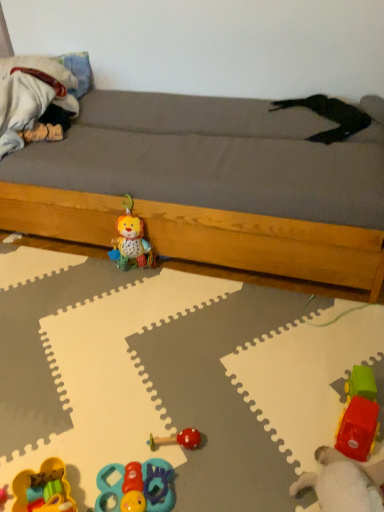
Question: Is rubberized plastic truck at lower right, marked as the 1th toy in a right-to-left arrangement, positioned behind plush fabric lion at center, arranged as the 5th toy when viewed from the right?

Choices:
 (A) yes
 (B) no

Answer: (B)

Question: Is rubberized plastic truck at lower right, marked as the 1th toy in a right-to-left arrangement, positioned with its back to plush fabric lion at center, arranged as the 5th toy when viewed from the right?

Choices:
 (A) yes
 (B) no

Answer: (B)

Question: Is rubberized plastic truck at lower right, the 6th toy positioned from the left, directly adjacent to plush fabric lion at center, arranged as the 5th toy when viewed from the right?

Choices:
 (A) yes
 (B) no

Answer: (B)

Question: Considering the relative sizes of rubberized plastic truck at lower right, the 6th toy positioned from the left, and plush fabric lion at center, arranged as the 5th toy when viewed from the right, in the image provided, is rubberized plastic truck at lower right, the 6th toy positioned from the left, bigger than plush fabric lion at center, arranged as the 5th toy when viewed from the right,?

Choices:
 (A) no
 (B) yes

Answer: (A)

Question: Does rubberized plastic truck at lower right, marked as the 1th toy in a right-to-left arrangement, appear on the right side of plush fabric lion at center, arranged as the 5th toy when viewed from the right?

Choices:
 (A) yes
 (B) no

Answer: (A)

Question: Considering their positions, is wooden bed frame at center located in front of or behind rubberized yellow toy at lower left, marked as the first toy in a left-to-right arrangement?

Choices:
 (A) behind
 (B) front

Answer: (A)

Question: From a real-world perspective, is wooden bed frame at center above or below rubberized yellow toy at lower left, which is counted as the 6th toy, starting from the right?

Choices:
 (A) above
 (B) below

Answer: (A)

Question: From their relative heights in the image, would you say wooden bed frame at center is taller or shorter than rubberized yellow toy at lower left, which is counted as the 6th toy, starting from the right?

Choices:
 (A) short
 (B) tall

Answer: (B)

Question: In terms of size, does wooden bed frame at center appear bigger or smaller than rubberized yellow toy at lower left, marked as the first toy in a left-to-right arrangement?

Choices:
 (A) small
 (B) big

Answer: (B)

Question: Considering the positions of fluffy white blanket at left and plush fabric lion at center, the 2th toy when ordered from left to right, in the image, is fluffy white blanket at left taller or shorter than plush fabric lion at center, the 2th toy when ordered from left to right,?

Choices:
 (A) short
 (B) tall

Answer: (A)

Question: Looking at the image, does fluffy white blanket at left seem bigger or smaller compared to plush fabric lion at center, the 2th toy when ordered from left to right?

Choices:
 (A) big
 (B) small

Answer: (A)

Question: Does point (18, 71) appear closer or farther from the camera than point (147, 265)?

Choices:
 (A) farther
 (B) closer

Answer: (A)

Question: Would you say fluffy white blanket at left is inside or outside plush fabric lion at center, the 2th toy when ordered from left to right?

Choices:
 (A) outside
 (B) inside

Answer: (A)

Question: Visually, is rubberized plastic car at lower right, the second toy from the right, positioned to the left or to the right of rubberized blue and red toy at lower center, arranged as the 4th toy when viewed from the right?

Choices:
 (A) right
 (B) left

Answer: (A)

Question: From a real-world perspective, is rubberized plastic car at lower right, the fifth toy when ordered from left to right, physically located above or below rubberized blue and red toy at lower center, arranged as the 4th toy when viewed from the right?

Choices:
 (A) below
 (B) above

Answer: (B)